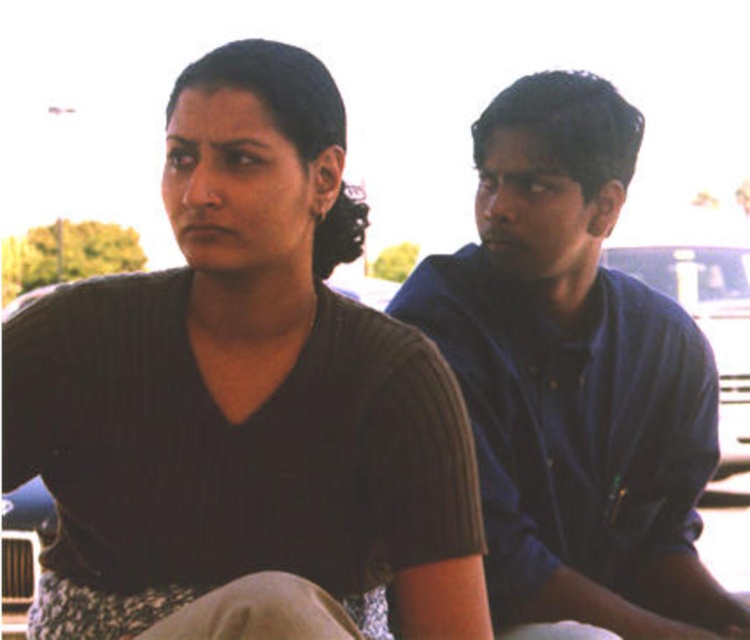
Who is more forward, (342, 250) or (696, 349)?

Point (342, 250) is in front.

The width and height of the screenshot is (750, 640). Find the location of `matte brown shirt at center`. matte brown shirt at center is located at coordinates (244, 388).